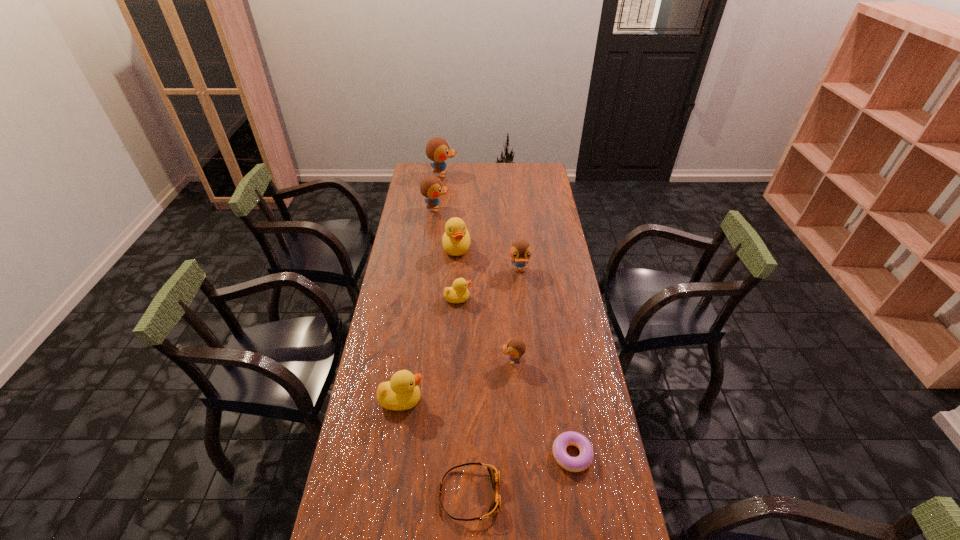
Image resolution: width=960 pixels, height=540 pixels. In the image, there is a desktop. Find the location of `free space at the far edge`. free space at the far edge is located at coordinates (448, 174).

Image resolution: width=960 pixels, height=540 pixels. Identify the location of vacant space at the left edge of the desktop. (413, 271).

Find the location of a particular element. vacant space at the right edge of the desktop is located at coordinates (540, 280).

Locate an element on the screen. This screenshot has width=960, height=540. vacant space at the far left corner is located at coordinates (432, 176).

Locate an element on the screen. Image resolution: width=960 pixels, height=540 pixels. vacant space at the far right corner of the desktop is located at coordinates (549, 179).

Where is `blank region between the shortest object and the smallest blue duck`? This screenshot has height=540, width=960. blank region between the shortest object and the smallest blue duck is located at coordinates (542, 408).

You are a GUI agent. You are given a task and a screenshot of the screen. Output one action in this format:
    pyautogui.click(x=<x>, y=<y>)
    Task: Click on the vacant region between the leftmost yellow duck and the biggest yellow duck
    
    Given the screenshot: What is the action you would take?
    pyautogui.click(x=429, y=324)

Where is `free space between the second shortest object and the second farthest object`? The image size is (960, 540). free space between the second shortest object and the second farthest object is located at coordinates coord(453,352).

The width and height of the screenshot is (960, 540). Find the location of `vacant area that lies between the sixth farthest duck and the second farthest duck`. vacant area that lies between the sixth farthest duck and the second farthest duck is located at coordinates (474, 285).

The image size is (960, 540). Find the location of `free space between the second farthest duck and the smallest yellow duck`. free space between the second farthest duck and the smallest yellow duck is located at coordinates (447, 254).